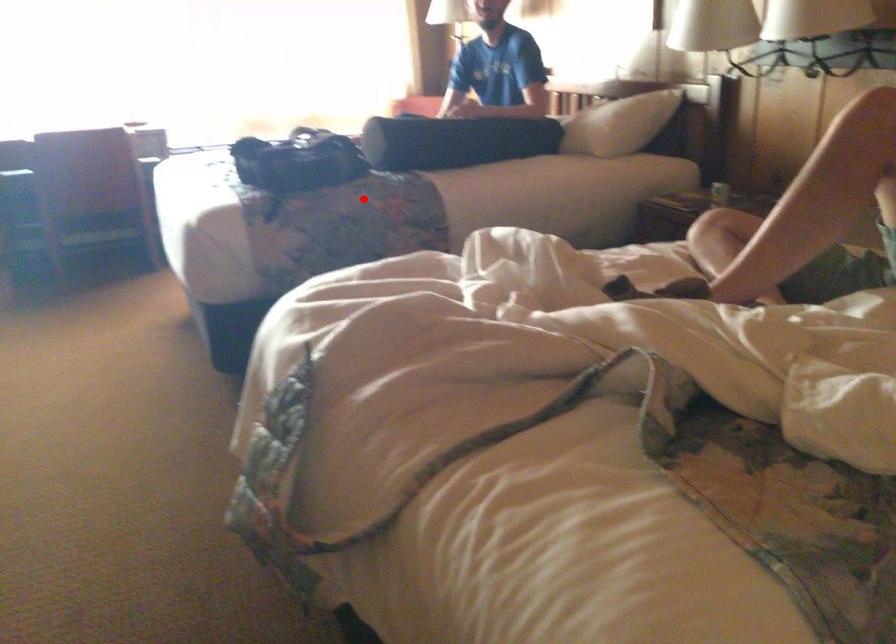
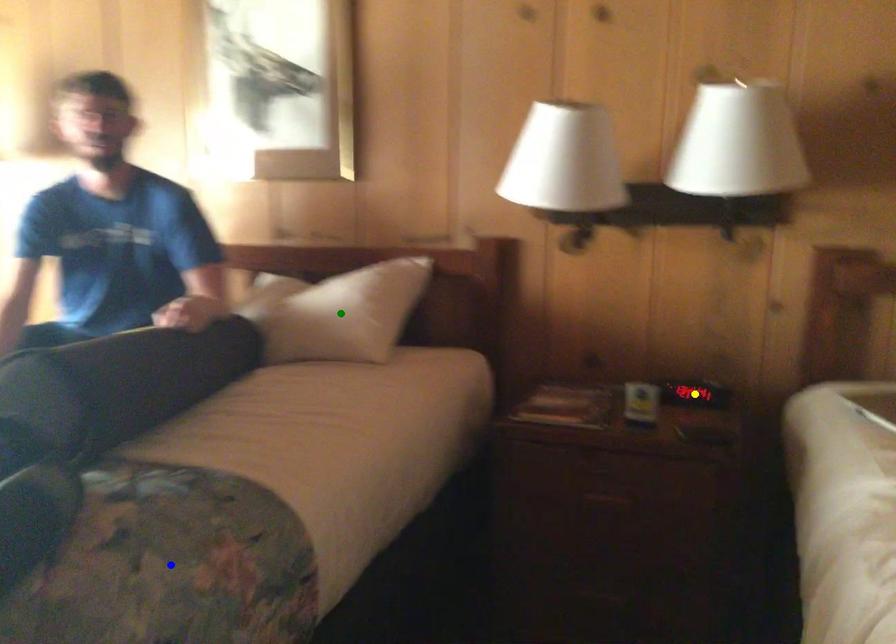
Question: I am providing you with two images of the same scene from different viewpoints. A red point is marked on the first image. You are given multiple points on the second image. Which point in image 2 is actually the same real-world point as the red point in image 1?

Choices:
 (A) blue point
 (B) green point
 (C) yellow point

Answer: (A)